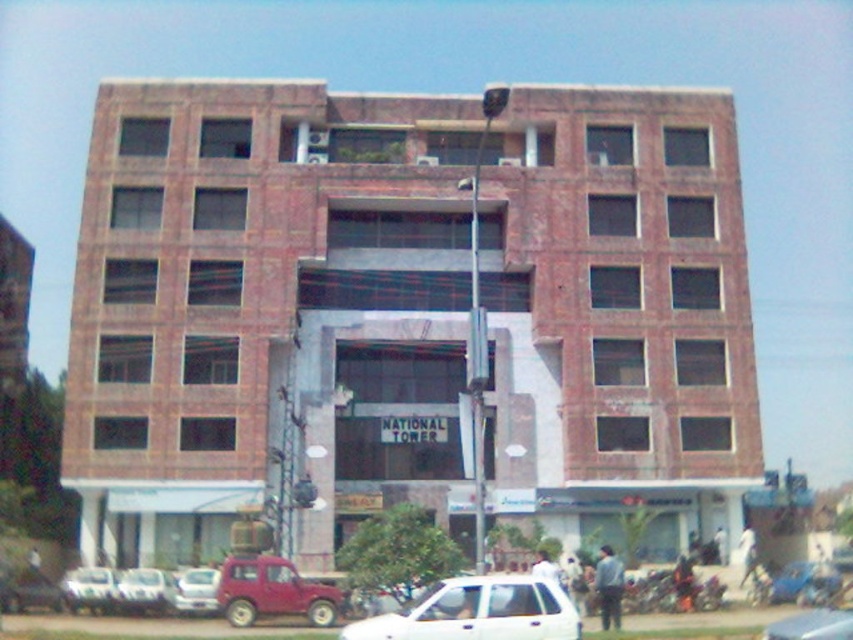
Can you confirm if silver metallic car at lower left is smaller than metallic silver car at lower left?

Yes, silver metallic car at lower left is smaller than metallic silver car at lower left.

Can you confirm if silver metallic car at lower left is positioned to the right of metallic silver car at lower left?

In fact, silver metallic car at lower left is to the left of metallic silver car at lower left.

Describe the element at coordinates (144, 589) in the screenshot. I see `silver metallic car at lower left` at that location.

This screenshot has height=640, width=853. Find the location of `silver metallic car at lower left`. silver metallic car at lower left is located at coordinates (144, 589).

Does metallic silver car at center have a greater width compared to white matte car at lower left?

Yes, metallic silver car at center is wider than white matte car at lower left.

You are a GUI agent. You are given a task and a screenshot of the screen. Output one action in this format:
    pyautogui.click(x=<x>, y=<y>)
    Task: Click on the metallic silver car at center
    The height and width of the screenshot is (640, 853).
    Given the screenshot: What is the action you would take?
    pyautogui.click(x=811, y=625)

Find the location of a particular element. metallic silver car at center is located at coordinates (811, 625).

Is metallic silver car at center positioned at the back of metallic silver car at lower left?

No, metallic silver car at center is closer to the viewer.

Does metallic silver car at center appear under metallic silver car at lower left?

No, metallic silver car at center is not below metallic silver car at lower left.

Which is in front, point (791, 627) or point (218, 582)?

Point (791, 627) is more forward.

The image size is (853, 640). Find the location of `metallic silver car at center`. metallic silver car at center is located at coordinates (811, 625).